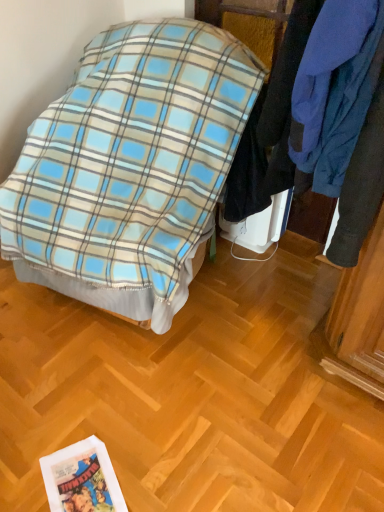
In order to face blue plaid blanket at center, should I rotate leftwards or rightwards?

A 7.995 degree turn to the left will do.

Image resolution: width=384 pixels, height=512 pixels. Describe the element at coordinates (130, 167) in the screenshot. I see `blue plaid blanket at center` at that location.

Consider the image. Measure the distance between blue plaid blanket at center and camera.

1.46 meters.

Measure the distance between point (194,216) and camera.

The distance of point (194,216) from camera is 1.55 meters.

Locate an element on the screen. This screenshot has height=512, width=384. blue plaid blanket at center is located at coordinates (130, 167).

Identify the location of blue fleece jacket at upper right. (330, 113).

The height and width of the screenshot is (512, 384). What do you see at coordinates (330, 113) in the screenshot?
I see `blue fleece jacket at upper right` at bounding box center [330, 113].

In order to click on blue plaid blanket at center in this screenshot , I will do `click(130, 167)`.

Which is more to the left, blue plaid blanket at center or blue fleece jacket at upper right?

blue plaid blanket at center is more to the left.

Does blue plaid blanket at center lie behind blue fleece jacket at upper right?

Yes, blue plaid blanket at center is behind blue fleece jacket at upper right.

Is point (180, 170) closer to camera compared to point (344, 74)?

No, (180, 170) is behind (344, 74).

From the image's perspective, between blue plaid blanket at center and blue fleece jacket at upper right, which one is located above?

blue fleece jacket at upper right.

Consider the image. From a real-world perspective, is blue plaid blanket at center positioned above or below blue fleece jacket at upper right?

blue plaid blanket at center is below blue fleece jacket at upper right.

Considering the sizes of blue plaid blanket at center and blue fleece jacket at upper right in the image, is blue plaid blanket at center wider or thinner than blue fleece jacket at upper right?

blue plaid blanket at center is wider than blue fleece jacket at upper right.

From their relative heights in the image, would you say blue plaid blanket at center is taller or shorter than blue fleece jacket at upper right?

In the image, blue plaid blanket at center appears to be taller than blue fleece jacket at upper right.

Based on the photo, is blue plaid blanket at center smaller than blue fleece jacket at upper right?

Incorrect, blue plaid blanket at center is not smaller in size than blue fleece jacket at upper right.

Is blue plaid blanket at center spatially inside blue fleece jacket at upper right, or outside of it?

blue plaid blanket at center is not inside blue fleece jacket at upper right, it's outside.

Consider the image. Is blue plaid blanket at center positioned far away from blue fleece jacket at upper right?

blue plaid blanket at center is actually quite close to blue fleece jacket at upper right.

Is blue plaid blanket at center aimed at blue fleece jacket at upper right?

No, blue plaid blanket at center is not oriented towards blue fleece jacket at upper right.

Can you tell me how much blue plaid blanket at center and blue fleece jacket at upper right differ in facing direction?

The facing directions of blue plaid blanket at center and blue fleece jacket at upper right are 2.51 degrees apart.

You are a GUI agent. You are given a task and a screenshot of the screen. Output one action in this format:
    pyautogui.click(x=<x>, y=<y>)
    Task: Click on the closet on the right side of blue plaid blanket at center
    Image resolution: width=384 pixels, height=512 pixels.
    Given the screenshot: What is the action you would take?
    pyautogui.click(x=330, y=113)

Between blue fleece jacket at upper right and blue plaid blanket at center, which one appears on the right side from the viewer's perspective?

blue fleece jacket at upper right.

Is blue fleece jacket at upper right in front of or behind blue plaid blanket at center in the image?

Clearly, blue fleece jacket at upper right is in front of blue plaid blanket at center.

Which is more distant, (265,109) or (120,70)?

The point (120,70) is farther from the camera.

From the image's perspective, is blue fleece jacket at upper right positioned above or below blue plaid blanket at center?

blue fleece jacket at upper right is above blue plaid blanket at center.

From a real-world perspective, is blue fleece jacket at upper right on top of blue plaid blanket at center?

Yes.

Which of these two, blue fleece jacket at upper right or blue plaid blanket at center, is thinner?

blue fleece jacket at upper right.

Is blue fleece jacket at upper right taller or shorter than blue plaid blanket at center?

In the image, blue fleece jacket at upper right appears to be shorter than blue plaid blanket at center.

Considering the relative sizes of blue fleece jacket at upper right and blue plaid blanket at center in the image provided, is blue fleece jacket at upper right smaller than blue plaid blanket at center?

Yes, blue fleece jacket at upper right is smaller than blue plaid blanket at center.

Is blue plaid blanket at center surrounded by blue fleece jacket at upper right?

Definitely not — blue plaid blanket at center is not inside blue fleece jacket at upper right.

Are blue fleece jacket at upper right and blue plaid blanket at center located far from each other?

No, blue fleece jacket at upper right is not far from blue plaid blanket at center.

Is blue fleece jacket at upper right oriented away from blue plaid blanket at center?

blue fleece jacket at upper right is not turned away from blue plaid blanket at center.

What's the angular difference between blue fleece jacket at upper right and blue plaid blanket at center's facing directions?

They differ by 2.51 degrees in their facing directions.

Identify the location of bed below the blue fleece jacket at upper right (from a real-world perspective). This screenshot has width=384, height=512. (130, 167).

Locate an element on the screen. bed that is behind the blue fleece jacket at upper right is located at coordinates (130, 167).

At what (x,y) coordinates should I click in order to perform the action: click on closet in front of the blue plaid blanket at center. Please return your answer as a coordinate pair (x, y). The width and height of the screenshot is (384, 512). Looking at the image, I should click on (330, 113).